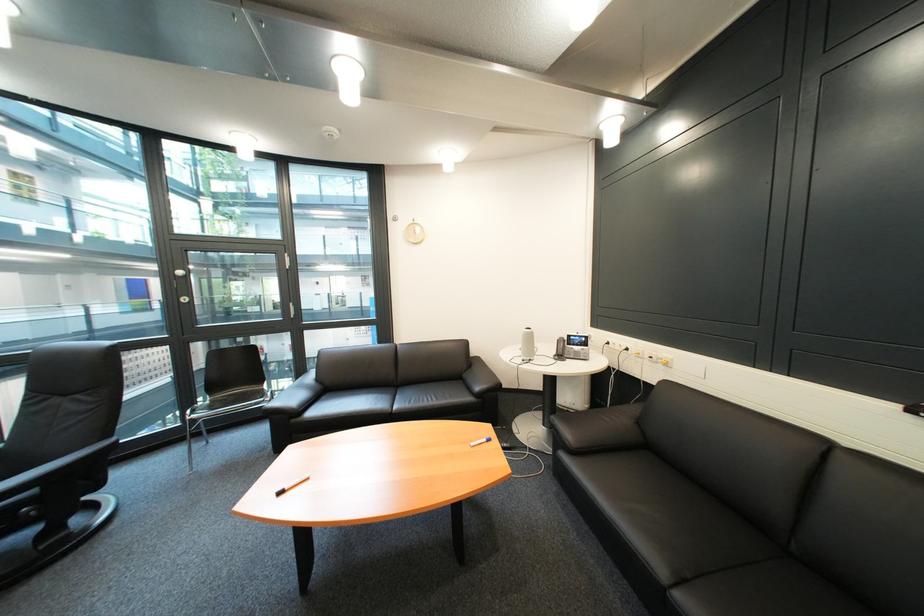
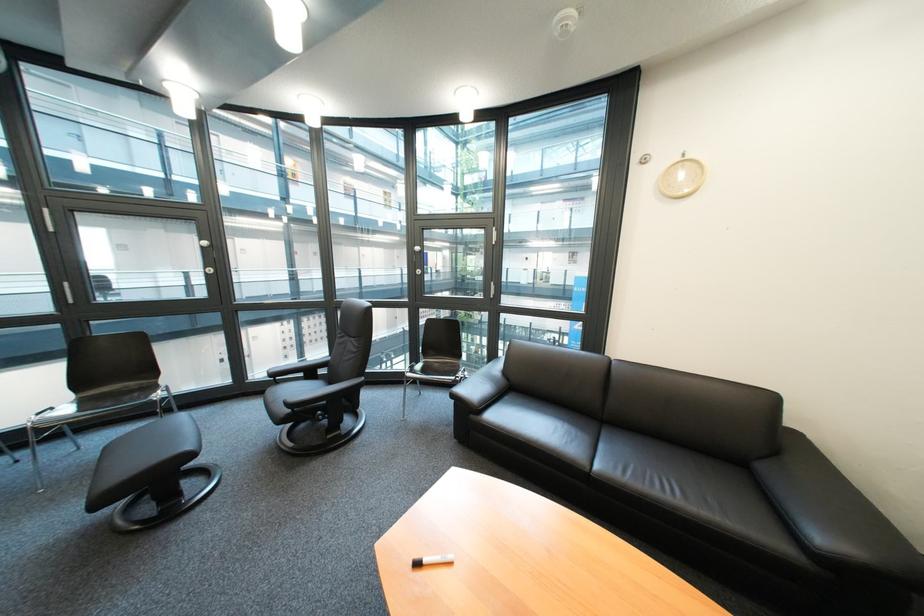
The point at (x=491, y=390) is marked in the first image. Where is the corresponding point in the second image?

(833, 540)